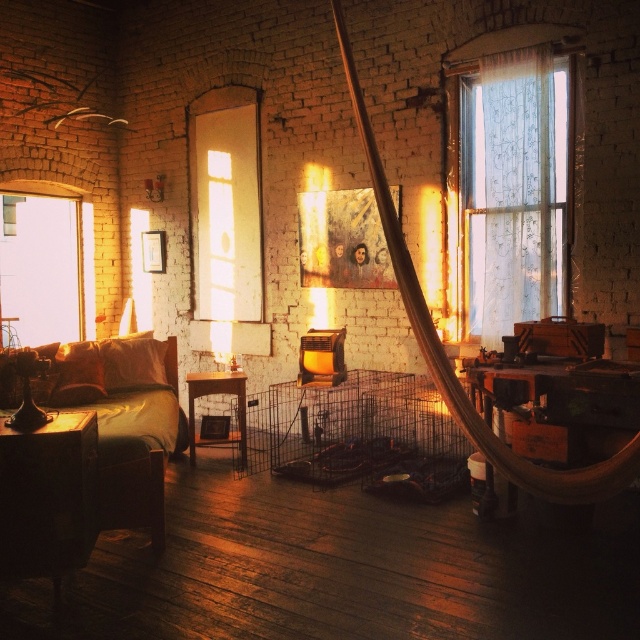
Question: Is dark wood nightstand at lower left in front of transparent glass window at left?

Choices:
 (A) yes
 (B) no

Answer: (A)

Question: Can you confirm if black wire cage at center is positioned to the left of dark wood nightstand at lower left?

Choices:
 (A) yes
 (B) no

Answer: (B)

Question: Which object appears closest to the camera in this image?

Choices:
 (A) suede-like brown couch at lower left
 (B) wooden table at center

Answer: (A)

Question: Which of these objects is positioned farthest from the transparent glass window at left?

Choices:
 (A) wooden table at center
 (B) translucent fabric curtain at upper right
 (C) suede-like brown couch at lower left

Answer: (B)

Question: Observing the image, what is the correct spatial positioning of black wire cage at center in reference to transparent glass window at left?

Choices:
 (A) right
 (B) left

Answer: (A)

Question: Which is nearer to the transparent glass window at center?

Choices:
 (A) suede-like brown couch at lower left
 (B) translucent fabric curtain at upper right
 (C) dark wood nightstand at lower left
 (D) transparent glass window at left

Answer: (D)